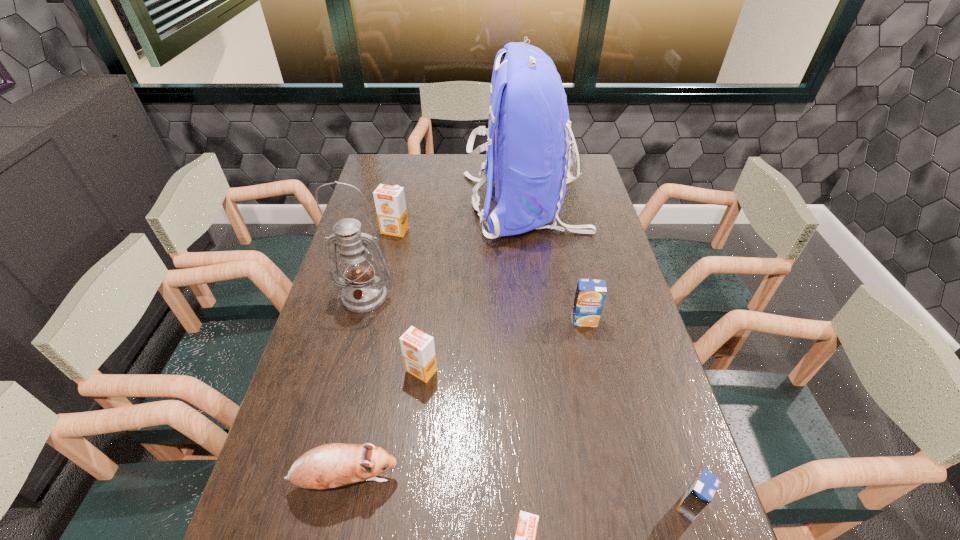
Find the location of a particular element. This screenshot has height=540, width=960. vacant space at the right edge is located at coordinates (637, 334).

In the image, there is a desktop. Identify the location of free region at the far left corner. (394, 166).

I want to click on unoccupied position between the farthest orange juice and the fourth farthest orange juice, so click(542, 368).

What are the coordinates of `free spot between the leftmost orange orange juice and the bigger blue orange_juice` in the screenshot? It's located at (490, 275).

At what (x,y) coordinates should I click in order to perform the action: click on vacant space that is in between the second biggest orange orange juice and the farther blue orange_juice. Please return your answer as a coordinate pair (x, y). Looking at the image, I should click on (503, 346).

Locate an element on the screen. Image resolution: width=960 pixels, height=540 pixels. free spot between the fourth orange juice from left to right and the blue backpack is located at coordinates (554, 264).

Find the location of `free space between the farther blue orange_juice and the rightmost orange juice`. free space between the farther blue orange_juice and the rightmost orange juice is located at coordinates (636, 413).

The height and width of the screenshot is (540, 960). Find the location of `vacant area between the second smallest orange orange juice and the backpack`. vacant area between the second smallest orange orange juice and the backpack is located at coordinates (473, 288).

I want to click on free space that is in between the seventh shortest object and the rightmost orange juice, so click(527, 401).

Identify which object is located as the seventh nearest to the smaller blue orange_juice. Please provide its 2D coordinates. Your answer should be formatted as a tuple, i.e. [(x, y)], where the tuple contains the x and y coordinates of a point satisfying the conditions above.

[(390, 203)]